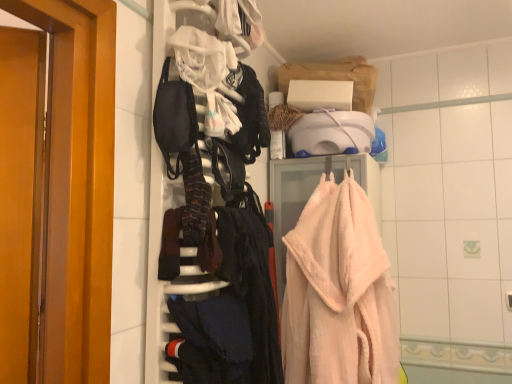
Question: From the image's perspective, does dark blue fabric at lower center appear higher than fluffy pink towel at right?

Choices:
 (A) yes
 (B) no

Answer: (B)

Question: Is dark blue fabric at lower center wider than fluffy pink towel at right?

Choices:
 (A) no
 (B) yes

Answer: (A)

Question: Can we say dark blue fabric at lower center lies outside fluffy pink towel at right?

Choices:
 (A) yes
 (B) no

Answer: (A)

Question: Could you tell me if dark blue fabric at lower center is turned towards fluffy pink towel at right?

Choices:
 (A) yes
 (B) no

Answer: (B)

Question: Is dark blue fabric at lower center not near fluffy pink towel at right?

Choices:
 (A) no
 (B) yes

Answer: (A)

Question: Does dark blue fabric at lower center have a smaller size compared to fluffy pink towel at right?

Choices:
 (A) yes
 (B) no

Answer: (A)

Question: From the image's perspective, is fluffy pink towel at right located beneath dark blue fabric at lower center?

Choices:
 (A) no
 (B) yes

Answer: (A)

Question: Is fluffy pink towel at right taller than dark blue fabric at lower center?

Choices:
 (A) no
 (B) yes

Answer: (B)

Question: Is the surface of fluffy pink towel at right in direct contact with dark blue fabric at lower center?

Choices:
 (A) no
 (B) yes

Answer: (A)

Question: Does fluffy pink towel at right have a greater width compared to dark blue fabric at lower center?

Choices:
 (A) no
 (B) yes

Answer: (B)

Question: Is fluffy pink towel at right behind dark blue fabric at lower center?

Choices:
 (A) no
 (B) yes

Answer: (B)

Question: Is fluffy pink towel at right at the left side of dark blue fabric at lower center?

Choices:
 (A) yes
 (B) no

Answer: (B)

Question: In terms of height, does fluffy pink towel at right look taller or shorter compared to dark blue fabric at lower center?

Choices:
 (A) short
 (B) tall

Answer: (B)